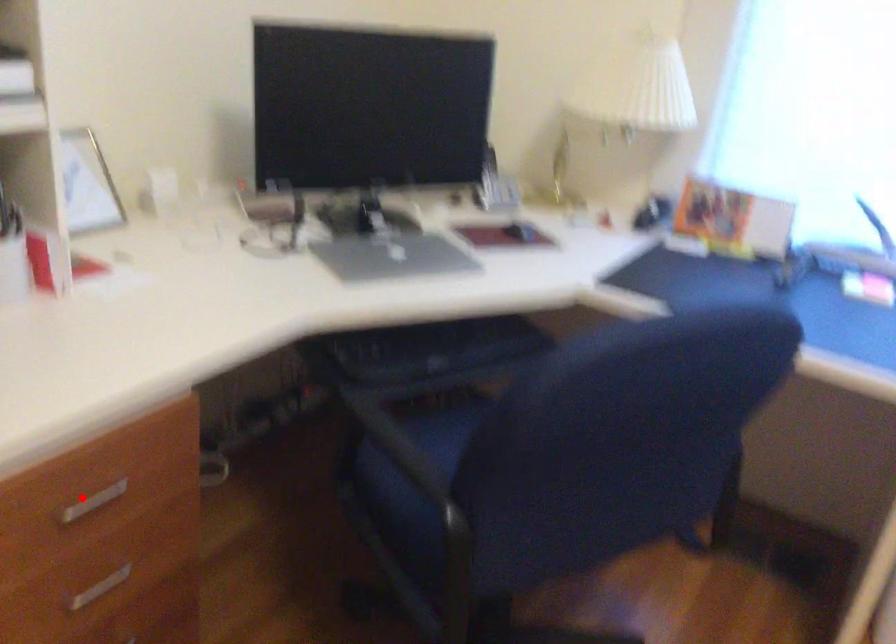
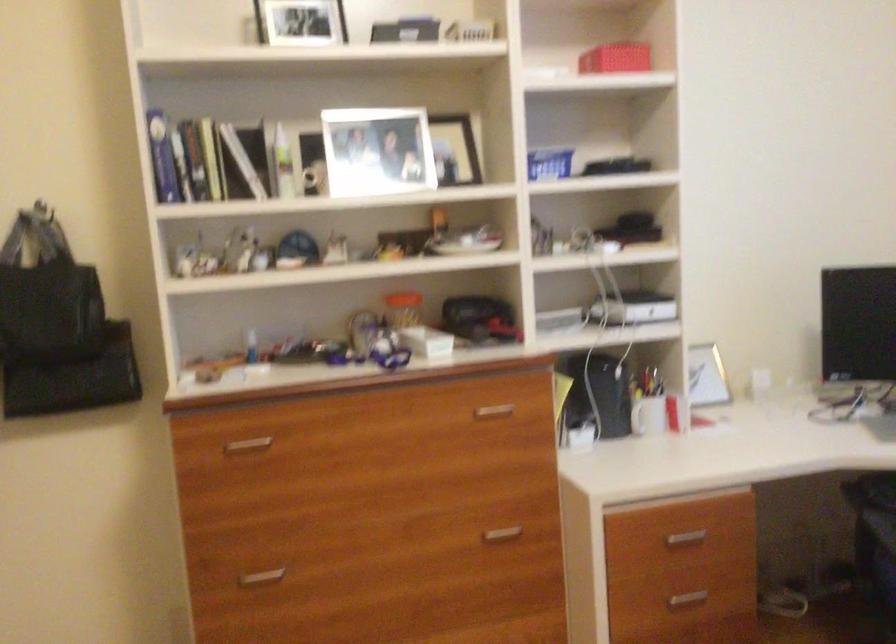
Find the pixel in the second image that matches the highlighted location in the first image.

(685, 538)